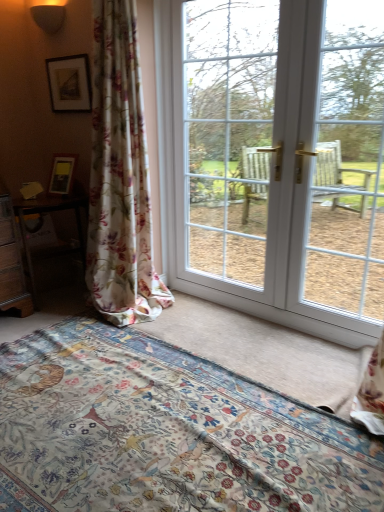
Locate an element on the screen. vacant region in front of wooden table at left is located at coordinates (50, 322).